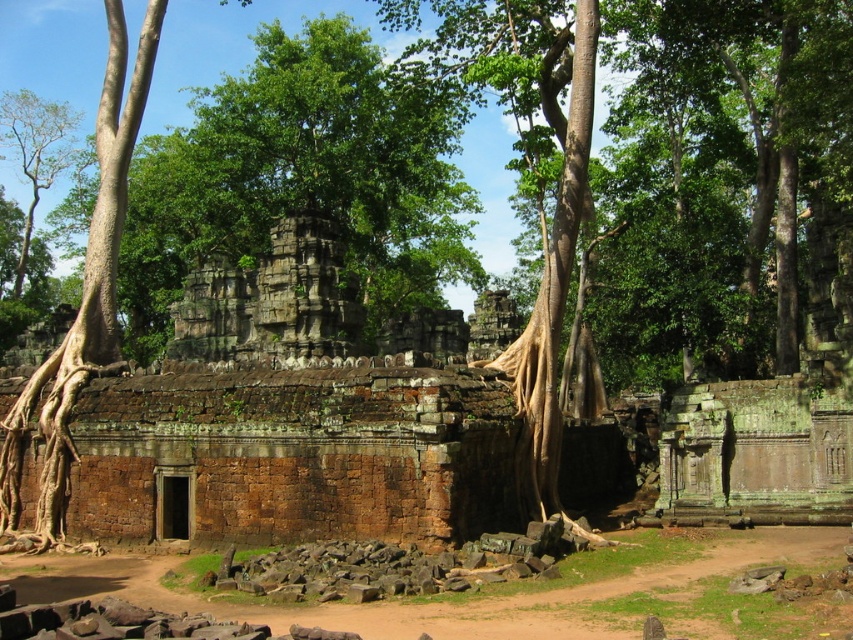
Is point (119, 116) more distant than point (24, 152)?

No, (119, 116) is in front of (24, 152).

Does brown rough tree roots at left appear over green leafy tree at upper left?

Actually, brown rough tree roots at left is below green leafy tree at upper left.

The width and height of the screenshot is (853, 640). Describe the element at coordinates (83, 292) in the screenshot. I see `brown rough tree roots at left` at that location.

This screenshot has width=853, height=640. I want to click on brown rough tree roots at left, so click(x=83, y=292).